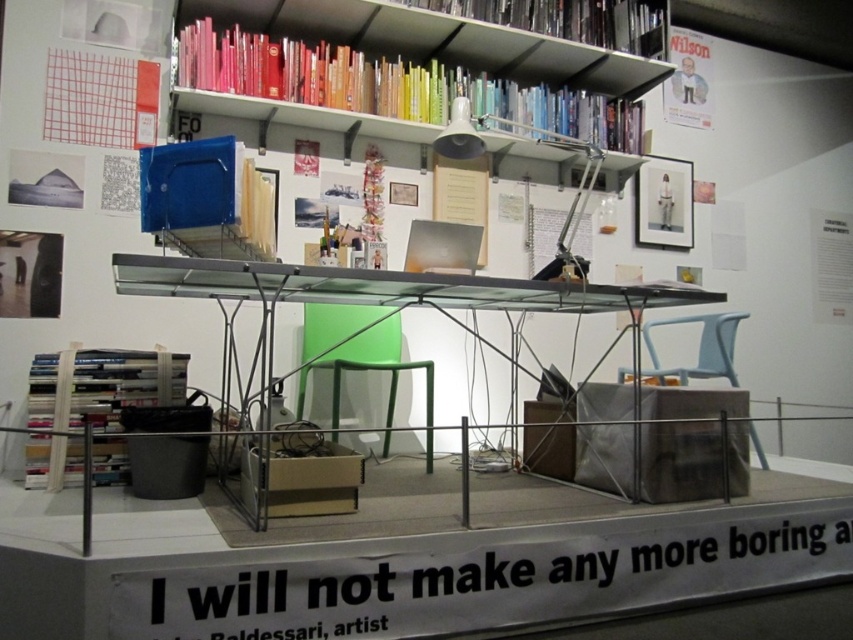
Looking at this image, you are standing at the entrance of the exhibit and want to walk towards the point labeled as point (556, 19). Will you pass by the point labeled as point (660, 212) before reaching your destination?

Yes, you will pass by point (660, 212) before reaching point (556, 19) because the latter is located in front of the former, meaning it is closer to your starting position at the entrance.

You are a visitor standing at the entrance of the exhibit and want to take a photo of the hardcover books at upper center. The camera you have can focus on objects up to 3 meters away. Will the camera be able to focus on the books?

The hardcover books at upper center are 3.14 meters away from the camera, which is beyond the 3 meter focusing range. The camera will not be able to focus on them.

From the picture: You are standing at the entrance of the exhibit and want to walk towards the point labeled as point (184, 396). Which direction should you move relative to the point labeled as point (664, 28)?

You should move towards the point labeled as point (184, 396) which is in front of point (664, 28).